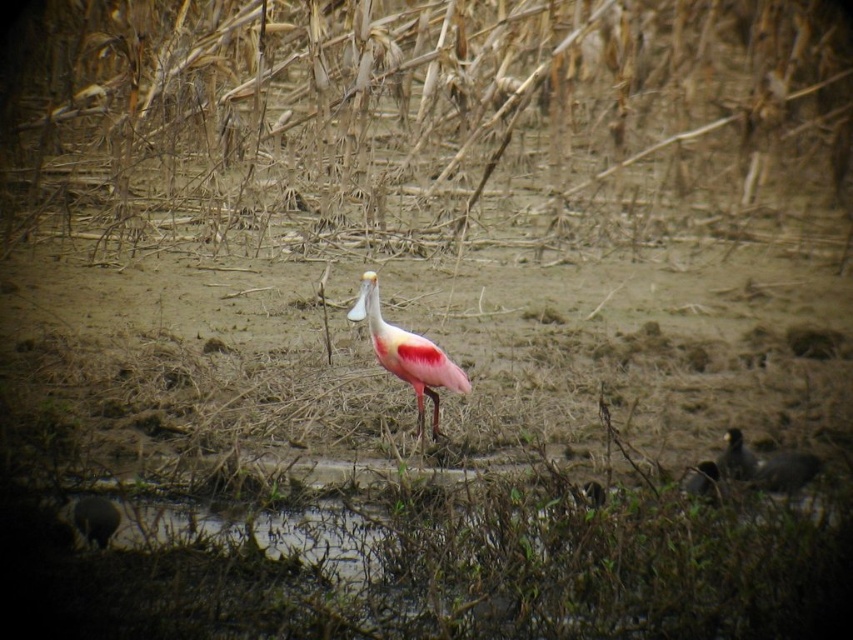
Question: Is brown dry reed at center further to camera compared to pink feathered bird at lower right?

Choices:
 (A) yes
 (B) no

Answer: (A)

Question: Does brown dry reed at center have a smaller size compared to pink matte spoonbill at center?

Choices:
 (A) yes
 (B) no

Answer: (B)

Question: Which object is farther from the camera taking this photo?

Choices:
 (A) pink feathered bird at center
 (B) pink feathered bird at lower right

Answer: (A)

Question: Estimate the real-world distances between objects in this image. Which object is closer to the pink feathered bird at lower right?

Choices:
 (A) pink feathered bird at center
 (B) pink matte spoonbill at center

Answer: (A)

Question: Among these points, which one is farthest from the camera?

Choices:
 (A) (419, 401)
 (B) (141, 26)

Answer: (B)

Question: Is brown dry reed at center below pink matte spoonbill at center?

Choices:
 (A) yes
 (B) no

Answer: (B)